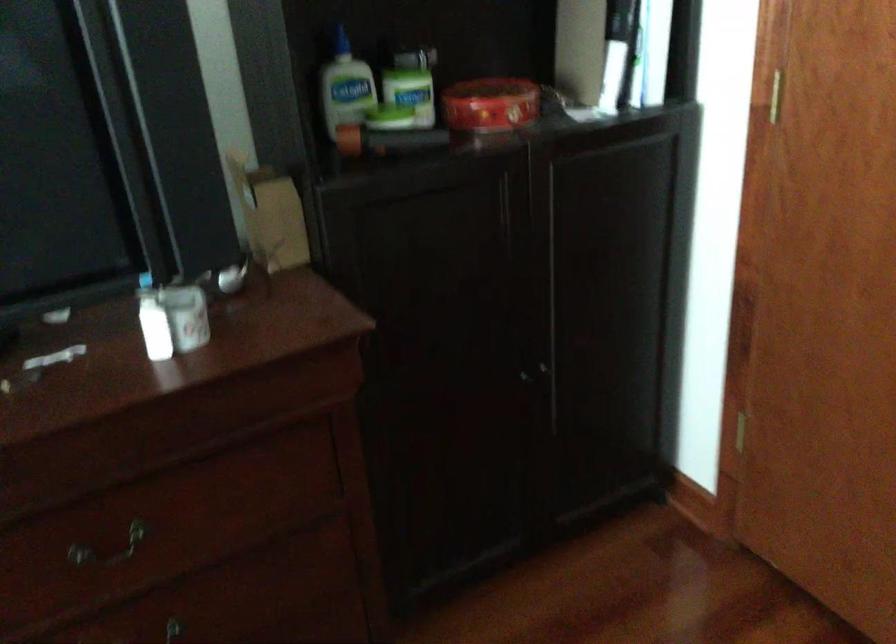
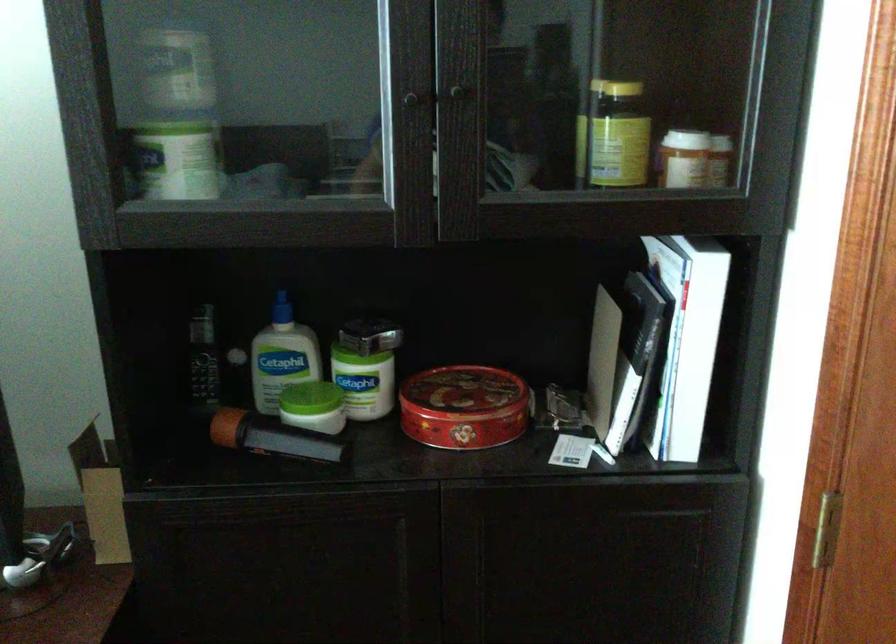
Question: How did the camera likely rotate?

Choices:
 (A) Left
 (B) Right
 (C) Up
 (D) Down

Answer: (A)